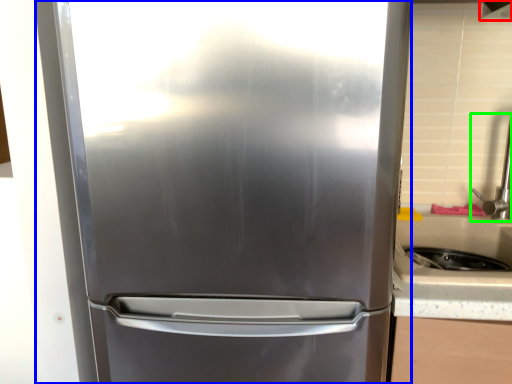
Question: Which object is positioned closest to exhaust hood (highlighted by a red box)? Select from refrigerator (highlighted by a blue box) and faucet (highlighted by a green box).

Choices:
 (A) refrigerator
 (B) faucet

Answer: (B)